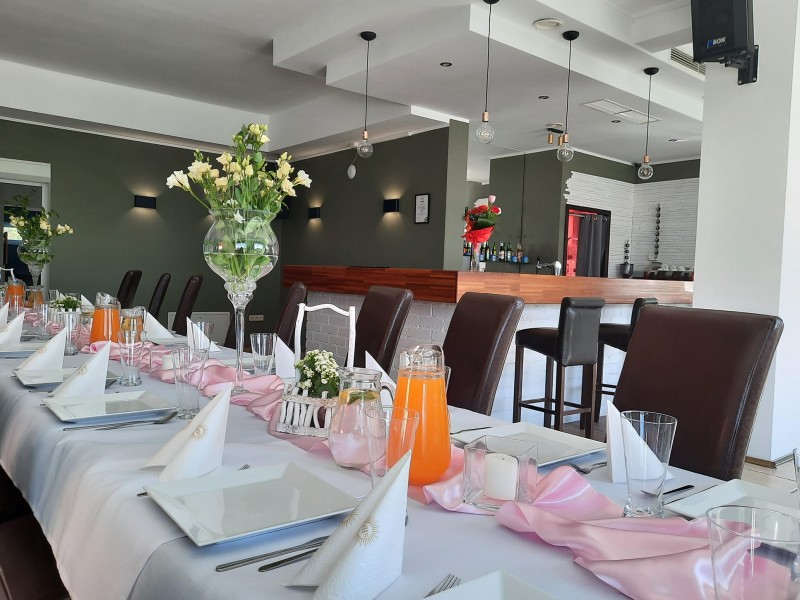
Image resolution: width=800 pixels, height=600 pixels. Identify the location of light fixtures. (138, 201), (312, 205), (398, 207), (369, 142), (486, 126), (565, 148), (648, 163), (10, 226).